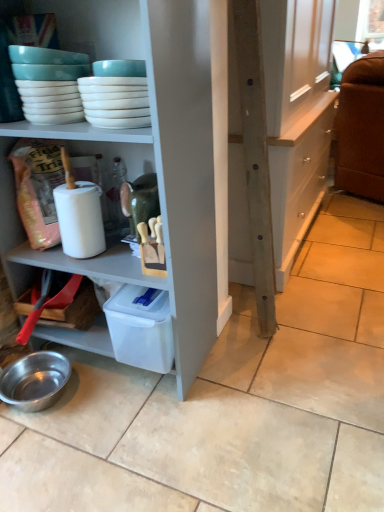
Find the location of `vacant area to the right of shiny metallic bowl at lower left`. vacant area to the right of shiny metallic bowl at lower left is located at coordinates (104, 398).